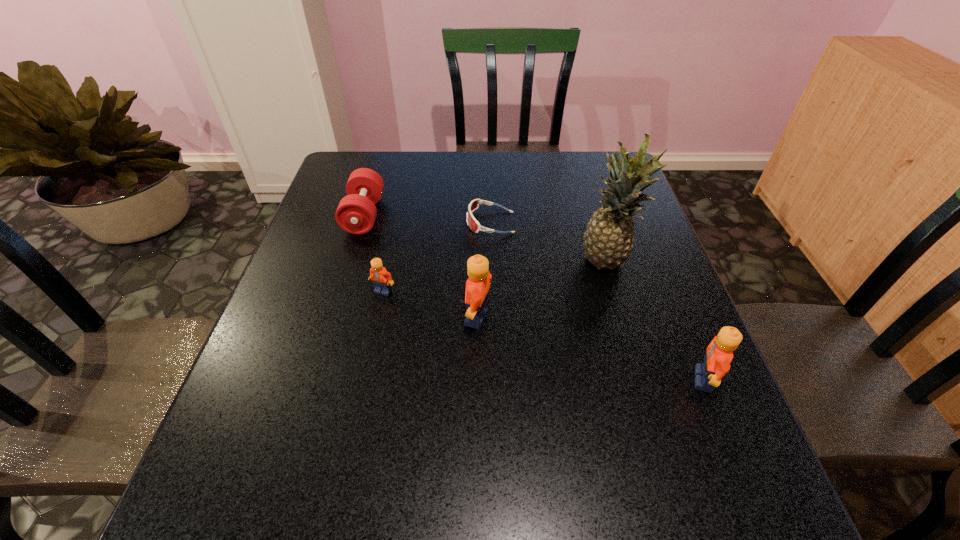
I want to click on free space located 0.120m on the front-facing side of the leftmost Lego, so click(373, 339).

The height and width of the screenshot is (540, 960). Identify the location of free space located on the front-facing side of the second nearest Lego. (405, 317).

What are the coordinates of `free spot located 0.160m on the front-facing side of the second nearest Lego` in the screenshot? It's located at (392, 317).

At what (x,y) coordinates should I click in order to perform the action: click on vacant space located on the front-facing side of the second nearest Lego. Please return your answer as a coordinate pair (x, y). Looking at the image, I should click on (305, 317).

Find the location of a particular element. The width and height of the screenshot is (960, 540). blank space located on the front-facing side of the nearest object is located at coordinates (521, 380).

At what (x,y) coordinates should I click in order to perform the action: click on vacant region located 0.130m on the front-facing side of the nearest object. Please return your answer as a coordinate pair (x, y). Looking at the image, I should click on (624, 380).

Image resolution: width=960 pixels, height=540 pixels. Identify the location of free space located on the front-facing side of the nearest object. (485, 380).

Where is `vacant space located 0.280m on the right of the dumbbell`? This screenshot has width=960, height=540. vacant space located 0.280m on the right of the dumbbell is located at coordinates (483, 215).

Locate an element on the screen. free space located 0.340m on the back of the third farthest object is located at coordinates (581, 173).

Where is `free space located 0.230m on the front-facing side of the goggles`? The height and width of the screenshot is (540, 960). free space located 0.230m on the front-facing side of the goggles is located at coordinates (382, 222).